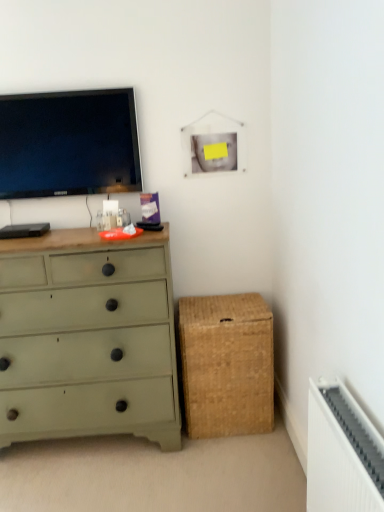
Question: From a real-world perspective, is green painted wood chest of drawers at left beneath braided wicker storage box at lower right?

Choices:
 (A) no
 (B) yes

Answer: (A)

Question: Does green painted wood chest of drawers at left have a greater width compared to braided wicker storage box at lower right?

Choices:
 (A) no
 (B) yes

Answer: (B)

Question: Would you say green painted wood chest of drawers at left contains braided wicker storage box at lower right?

Choices:
 (A) no
 (B) yes

Answer: (A)

Question: From the image's perspective, is green painted wood chest of drawers at left under braided wicker storage box at lower right?

Choices:
 (A) yes
 (B) no

Answer: (B)

Question: Does green painted wood chest of drawers at left have a smaller size compared to braided wicker storage box at lower right?

Choices:
 (A) yes
 (B) no

Answer: (B)

Question: Is green painted wood chest of drawers at left to the left or to the right of matte black tv at upper left in the image?

Choices:
 (A) left
 (B) right

Answer: (B)

Question: Would you say green painted wood chest of drawers at left is inside or outside matte black tv at upper left?

Choices:
 (A) inside
 (B) outside

Answer: (B)

Question: Relative to matte black tv at upper left, is green painted wood chest of drawers at left in front or behind?

Choices:
 (A) behind
 (B) front

Answer: (B)

Question: Considering the positions of green painted wood chest of drawers at left and matte black tv at upper left in the image, is green painted wood chest of drawers at left bigger or smaller than matte black tv at upper left?

Choices:
 (A) big
 (B) small

Answer: (A)

Question: From a real-world perspective, is braided wicker storage box at lower right physically located above or below green painted wood chest of drawers at left?

Choices:
 (A) below
 (B) above

Answer: (A)

Question: From their relative heights in the image, would you say braided wicker storage box at lower right is taller or shorter than green painted wood chest of drawers at left?

Choices:
 (A) short
 (B) tall

Answer: (A)

Question: Considering the positions of braided wicker storage box at lower right and green painted wood chest of drawers at left in the image, is braided wicker storage box at lower right wider or thinner than green painted wood chest of drawers at left?

Choices:
 (A) thin
 (B) wide

Answer: (A)

Question: Is braided wicker storage box at lower right to the left or to the right of green painted wood chest of drawers at left in the image?

Choices:
 (A) left
 (B) right

Answer: (B)

Question: From the image's perspective, relative to braided wicker storage box at lower right, is green painted wood chest of drawers at left above or below?

Choices:
 (A) below
 (B) above

Answer: (B)

Question: Relative to braided wicker storage box at lower right, is green painted wood chest of drawers at left in front or behind?

Choices:
 (A) behind
 (B) front

Answer: (B)